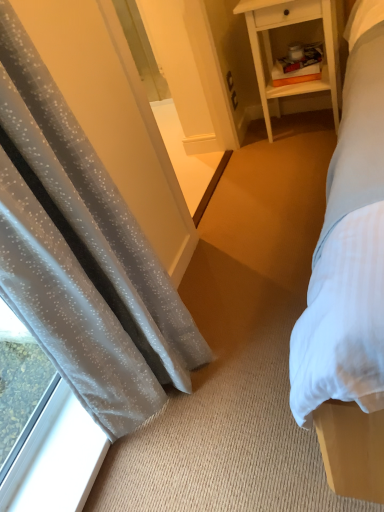
This screenshot has height=512, width=384. In order to click on free point above transparent glass window at lower left (from a real-world perspective) in this screenshot , I will do `click(64, 450)`.